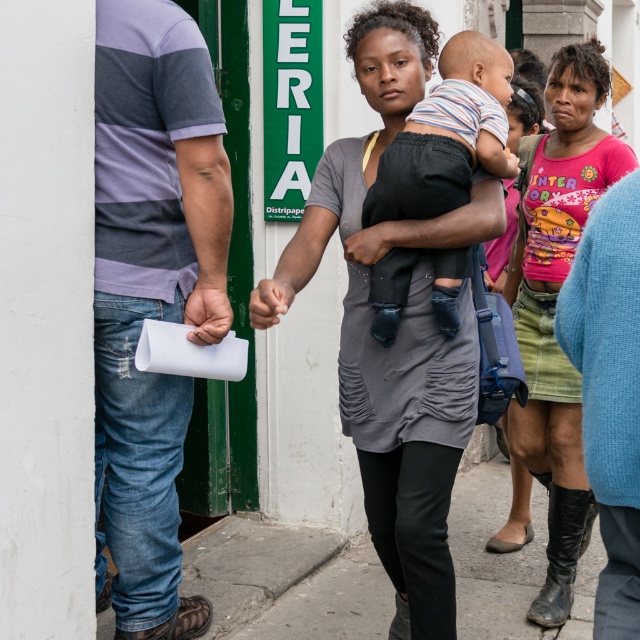
You are a delivery person carrying a box that requires a 2 meter clearance to pass through a narrow alley. You see the striped cotton shirt at left and the matte pink shirt at center in the scene. Is there enough space between them to navigate through with your box?

The distance between the striped cotton shirt at left and the matte pink shirt at center is 2.16 meters, which is more than the required 2 meter clearance. Therefore, there is sufficient space to navigate through with the box.

You are standing on the gray concrete pavement at lower center and want to hand a leaflet to the person wearing the matte pink shirt at center. In which direction should you move to reach them?

The matte pink shirt at center is positioned on the right side of gray concrete pavement at lower center, so you should move to your right to reach them.

Looking at this image, you are a tailor observing the striped cotton shirt at left and the matte pink shirt at center. Which shirt has a larger width according to the description?

The striped cotton shirt at left has a larger width than the matte pink shirt at center as stated in the description.